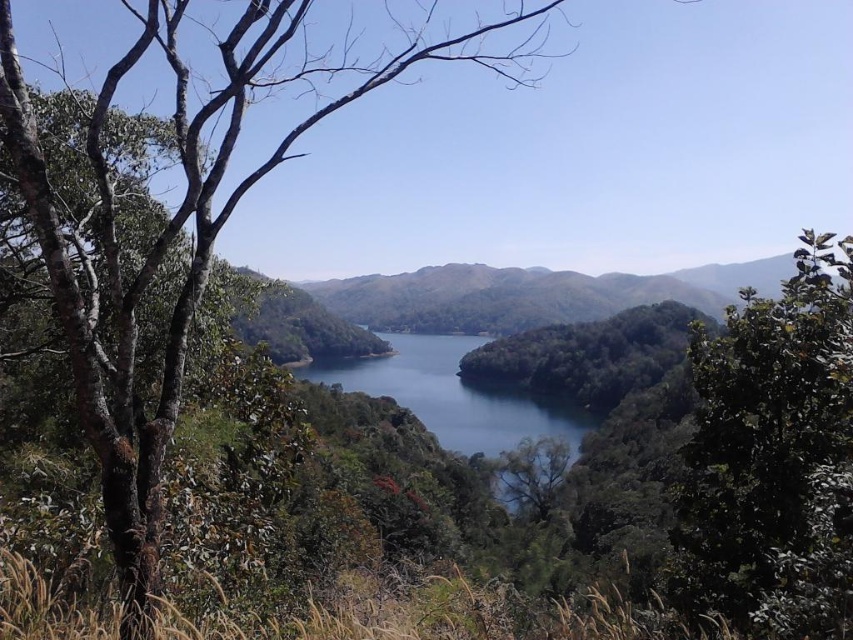
Question: From the image, what is the correct spatial relationship of green leafy tree at left in relation to green matte mountain at center?

Choices:
 (A) left
 (B) right

Answer: (A)

Question: Which point is closer to the camera?

Choices:
 (A) green leafy tree at right
 (B) green leafy tree at left
 (C) green matte mountain at center

Answer: (A)

Question: Is green leafy tree at left above green matte mountain at center?

Choices:
 (A) yes
 (B) no

Answer: (A)

Question: Does green matte mountain at center appear on the right side of blue glassy water at center?

Choices:
 (A) no
 (B) yes

Answer: (B)

Question: Among these objects, which one is nearest to the camera?

Choices:
 (A) green leafy tree at right
 (B) green leafy tree at left

Answer: (A)

Question: Which point is farther to the camera?

Choices:
 (A) (701, 522)
 (B) (392, 328)

Answer: (B)